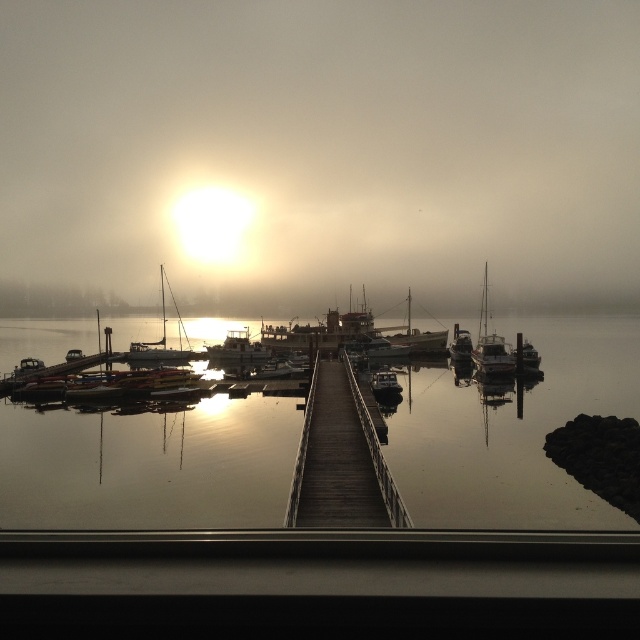
Does point (492, 365) come behind point (529, 349)?

No, (492, 365) is closer to viewer.

Does shiny silver sailboat at right have a larger size compared to metallic silver boat at right?

Indeed, shiny silver sailboat at right has a larger size compared to metallic silver boat at right.

Is point (488, 356) positioned in front of point (524, 369)?

Yes, it is in front of point (524, 369).

Locate an element on the screen. The width and height of the screenshot is (640, 640). shiny silver sailboat at right is located at coordinates (490, 342).

Is shiny silver sailboat at right below shiny silver sailboat at left?

Yes.

Is shiny silver sailboat at right to the left of shiny silver sailboat at left from the viewer's perspective?

No, shiny silver sailboat at right is not to the left of shiny silver sailboat at left.

I want to click on shiny silver sailboat at right, so click(x=490, y=342).

Consider the image. Does foggy mist at center have a greater width compared to smooth white sailboat at center?

Correct, the width of foggy mist at center exceeds that of smooth white sailboat at center.

Locate an element on the screen. The width and height of the screenshot is (640, 640). foggy mist at center is located at coordinates (317, 154).